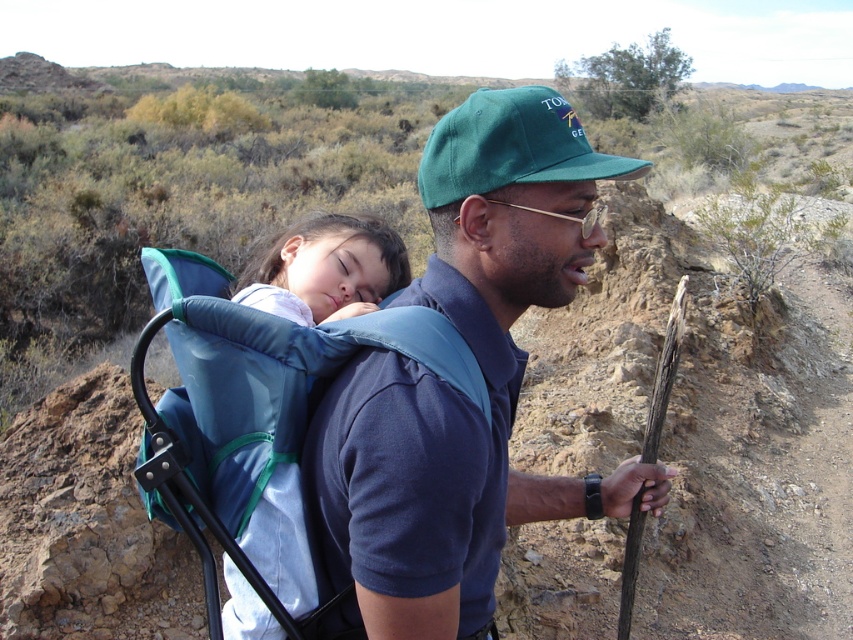
Can you confirm if blue fabric backpack at upper left is taller than green fabric baseball cap at center?

Yes, blue fabric backpack at upper left is taller than green fabric baseball cap at center.

Can you confirm if blue fabric backpack at upper left is positioned to the right of green fabric baseball cap at center?

In fact, blue fabric backpack at upper left is to the left of green fabric baseball cap at center.

Who is more forward, (514, 284) or (465, 120)?

Positioned in front is point (465, 120).

Where is `blue fabric backpack at upper left`? blue fabric backpack at upper left is located at coordinates (456, 392).